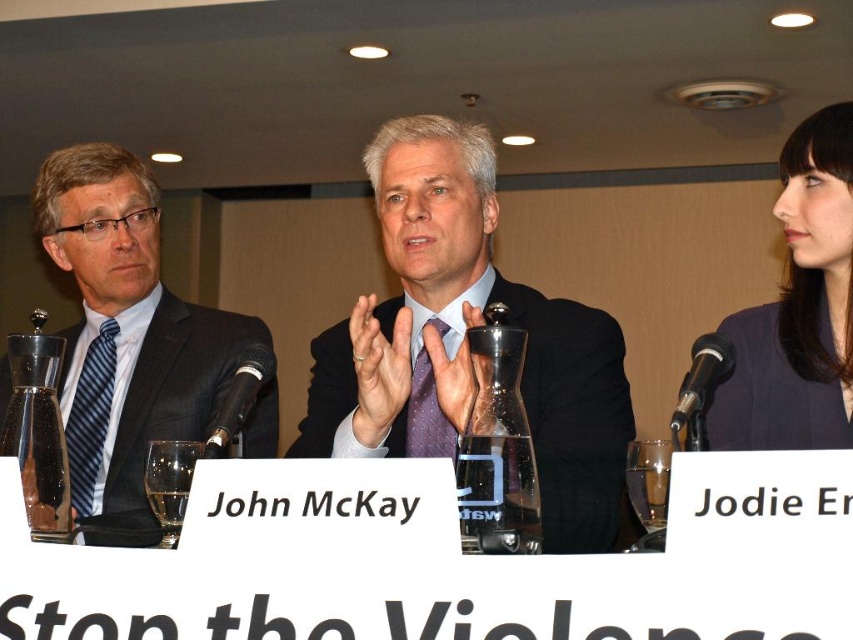
Question: Which of the following is the farthest from the observer?

Choices:
 (A) coord(239,396)
 (B) coord(231,358)
 (C) coord(447,304)
 (D) coord(846,154)

Answer: (B)

Question: Does matte black suit at left have a greater width compared to dark blue fabric at right?

Choices:
 (A) yes
 (B) no

Answer: (A)

Question: Does matte black suit at center appear on the left side of black plastic microphone at center?

Choices:
 (A) no
 (B) yes

Answer: (A)

Question: Considering the relative positions of matte black suit at center and black metallic microphone at right in the image provided, where is matte black suit at center located with respect to black metallic microphone at right?

Choices:
 (A) above
 (B) below

Answer: (A)

Question: Based on their relative distances, which object is farther from the dark blue fabric at right?

Choices:
 (A) dark blue fabric business suit at right
 (B) matte black suit at center
 (C) matte black suit at left
 (D) black plastic microphone at center

Answer: (C)

Question: Which of the following is the farthest from the observer?

Choices:
 (A) (813, 369)
 (B) (686, 394)
 (C) (706, 444)

Answer: (A)